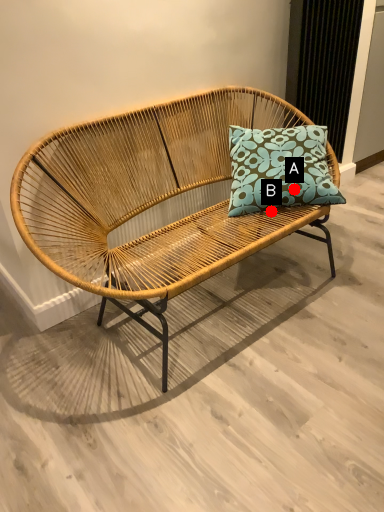
Question: Two points are circled on the image, labeled by A and B beside each circle. Which of the following is the closest to the observer?

Choices:
 (A) A is closer
 (B) B is closer

Answer: (A)